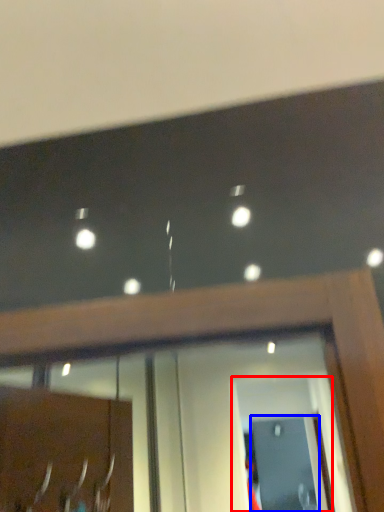
Question: Which point is further to the camera, screen door (highlighted by a red box) or screen door (highlighted by a blue box)?

Choices:
 (A) screen door
 (B) screen door

Answer: (B)